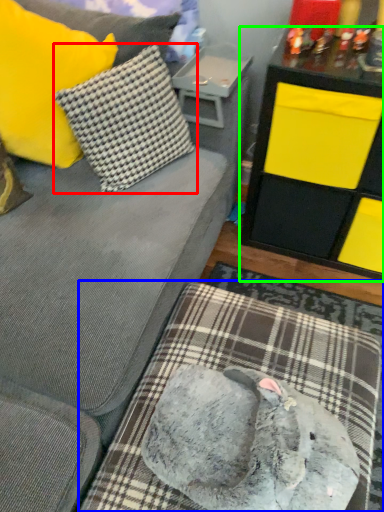
Question: Which is nearer to the pillow (highlighted by a red box)? dog bed (highlighted by a blue box) or table (highlighted by a green box).

Choices:
 (A) dog bed
 (B) table

Answer: (B)